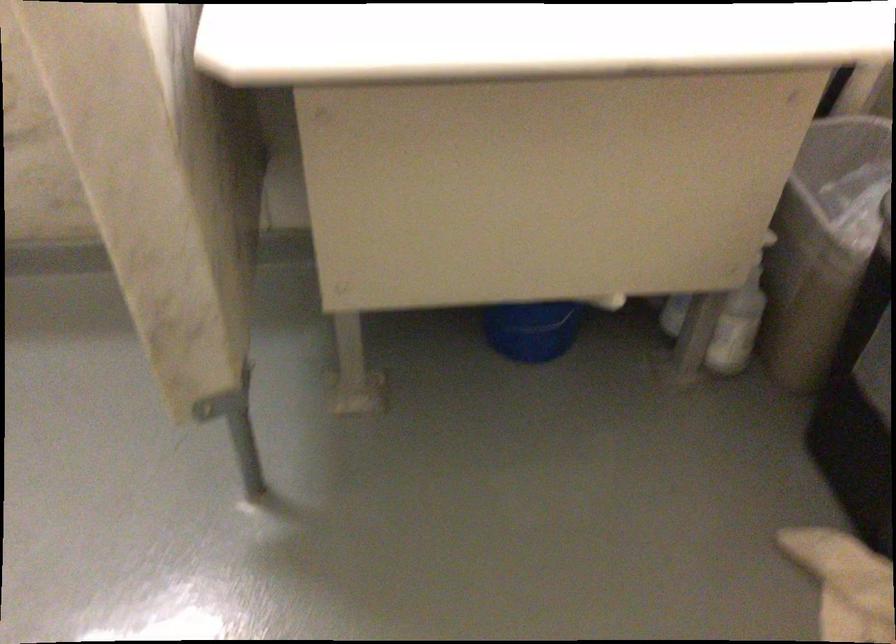
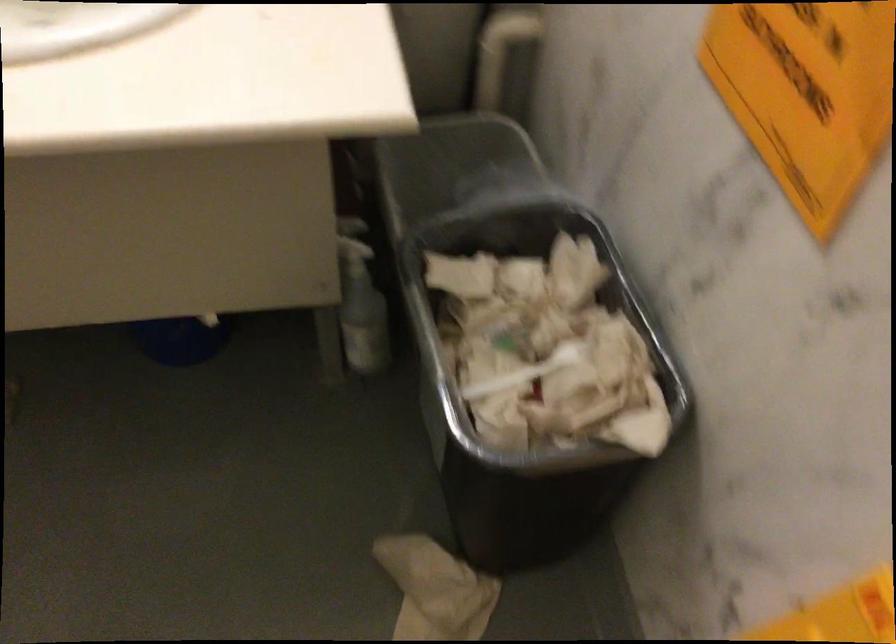
Locate, in the second image, the point that corresponds to the point at 742,292 in the first image.

(360, 303)